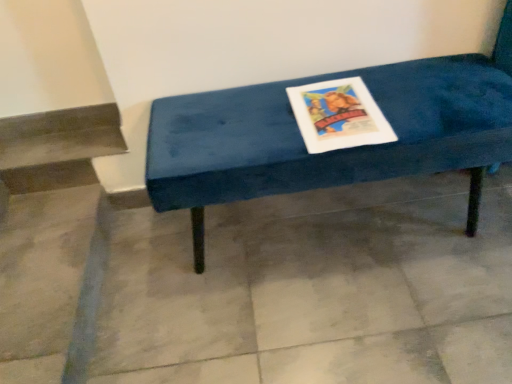
Locate an element on the screen. vacant area that lies in front of velvet blue bench at center is located at coordinates (357, 316).